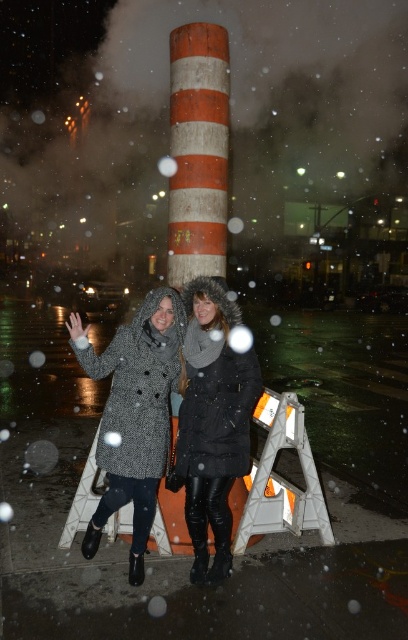
Question: Can you confirm if textured wool coat at center is smaller than black leather coat at center?

Choices:
 (A) no
 (B) yes

Answer: (A)

Question: Can you confirm if textured wool coat at center is smaller than black leather coat at center?

Choices:
 (A) yes
 (B) no

Answer: (B)

Question: Which point appears closest to the camera in this image?

Choices:
 (A) (164, 289)
 (B) (192, 436)

Answer: (B)

Question: Which point is closer to the camera?

Choices:
 (A) (210, 285)
 (B) (232, 461)

Answer: (B)

Question: Which of the following is the farthest from the observer?

Choices:
 (A) black leather coat at center
 (B) textured wool coat at center

Answer: (A)

Question: Where is textured wool coat at center located in relation to black leather coat at center in the image?

Choices:
 (A) above
 (B) below

Answer: (A)